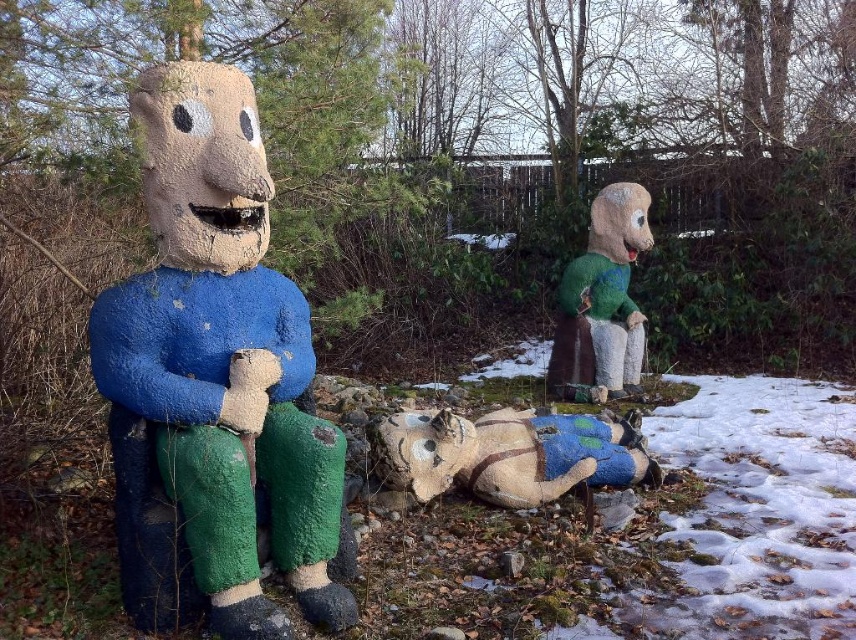
You are standing in front of the three figures and want to touch the point closer to you between point (263, 465) and point (446, 417). Which point should you reach for?

You should reach for point (263, 465) because it is closer to you than point (446, 417).

You are an artist setting up a winter scene display. You have a blue painted wood horse at center and a green felt doll at right. Based on their sizes, which object should you place closer to the front to create a sense of depth?

The blue painted wood horse at center is smaller than the green felt doll at right, so placing the larger green felt doll at right closer to the front will create a sense of depth.

You are an artist planning to paint a mural inspired by this winter scene. You want to ensure the blue painted wood figure at left and the green felt doll at right are proportionally accurate. Based on their sizes in the original image, which figure should you make larger in your mural?

The blue painted wood figure at left should be made larger in the mural since it has a greater height compared to the green felt doll at right according to the description.